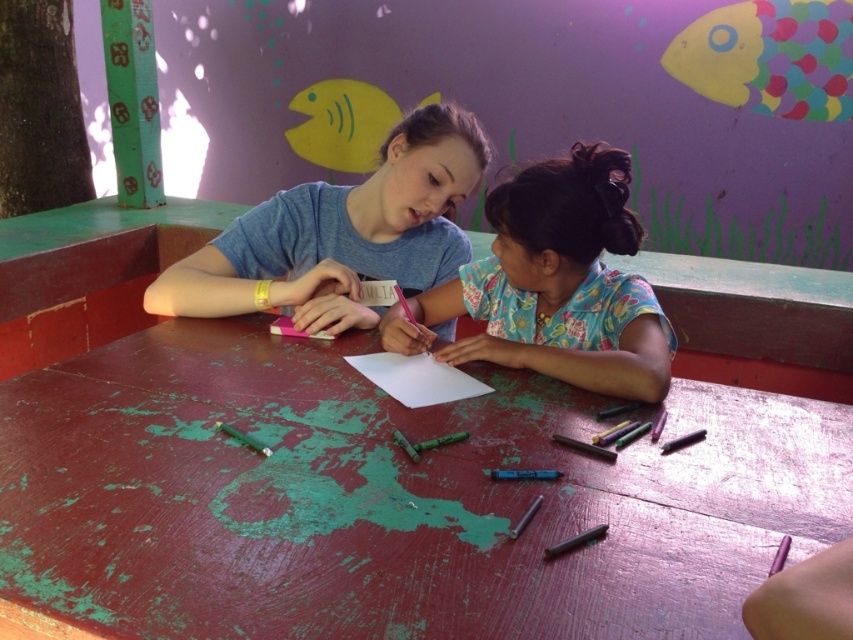
You are a photographer standing at the camera position. You want to capture a closeup shot of the metallic purple crayon at lower right. Considering the distance between the camera and the crayon, is the crayon within your reach to adjust its position before taking the photo?

The metallic purple crayon at lower right is 21.84 inches away from the camera. Since this distance is manageable for reaching out, you can adjust its position before taking the photo.